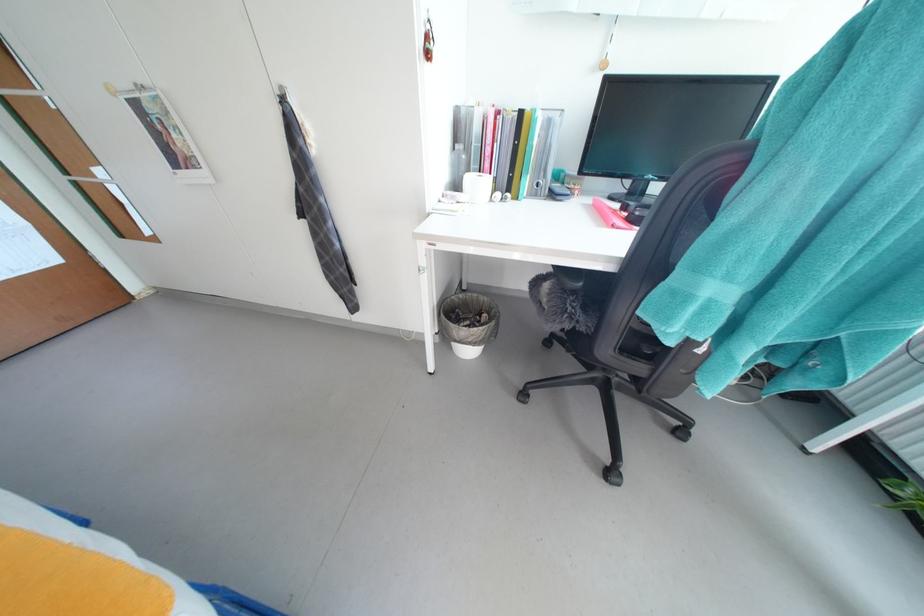
In order to click on black ring binder in this screenshot , I will do `click(505, 148)`.